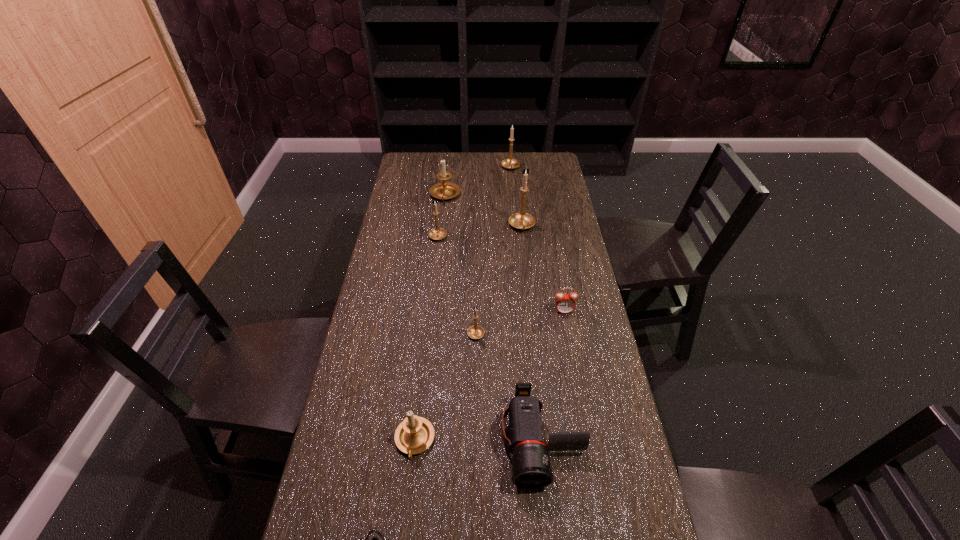
Identify the location of vacant area that lies between the smallest gold candle holder and the fifth farthest object. The height and width of the screenshot is (540, 960). (520, 321).

Identify the location of empty space that is in between the nearer beige candle holder and the fifth shortest candle holder. This screenshot has width=960, height=540. (463, 305).

Identify which object is the closest to the fifth nearest object. Please provide its 2D coordinates. Your answer should be formatted as a tuple, i.e. [(x, y)], where the tuple contains the x and y coordinates of a point satisfying the conditions above.

[(475, 332)]

The width and height of the screenshot is (960, 540). Find the location of `object that is the closest to the tallest candle holder`. object that is the closest to the tallest candle holder is located at coordinates (445, 190).

Locate which candle holder is the closest to the biggest gold candle holder. Please provide its 2D coordinates. Your answer should be formatted as a tuple, i.e. [(x, y)], where the tuple contains the x and y coordinates of a point satisfying the conditions above.

[(445, 190)]

Identify which candle holder is the fifth nearest to the farthest object. Please provide its 2D coordinates. Your answer should be formatted as a tuple, i.e. [(x, y)], where the tuple contains the x and y coordinates of a point satisfying the conditions above.

[(415, 434)]

Where is `the fourth closest gold candle holder to the nearer beige candle holder`? the fourth closest gold candle holder to the nearer beige candle holder is located at coordinates (510, 163).

At what (x,y) coordinates should I click in order to perform the action: click on gold candle holder that is the third closest to the nearest candle holder. Please return your answer as a coordinate pair (x, y). The height and width of the screenshot is (540, 960). Looking at the image, I should click on pyautogui.click(x=522, y=220).